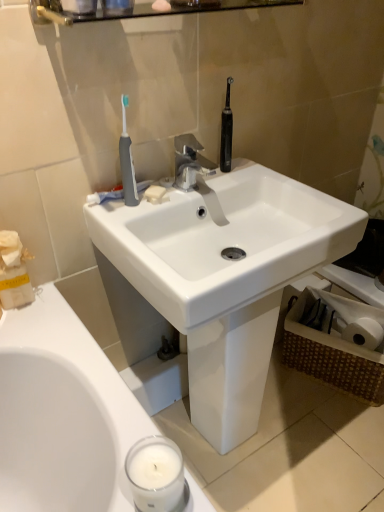
Identify the location of free space behind white matte soap at sink center. (176, 179).